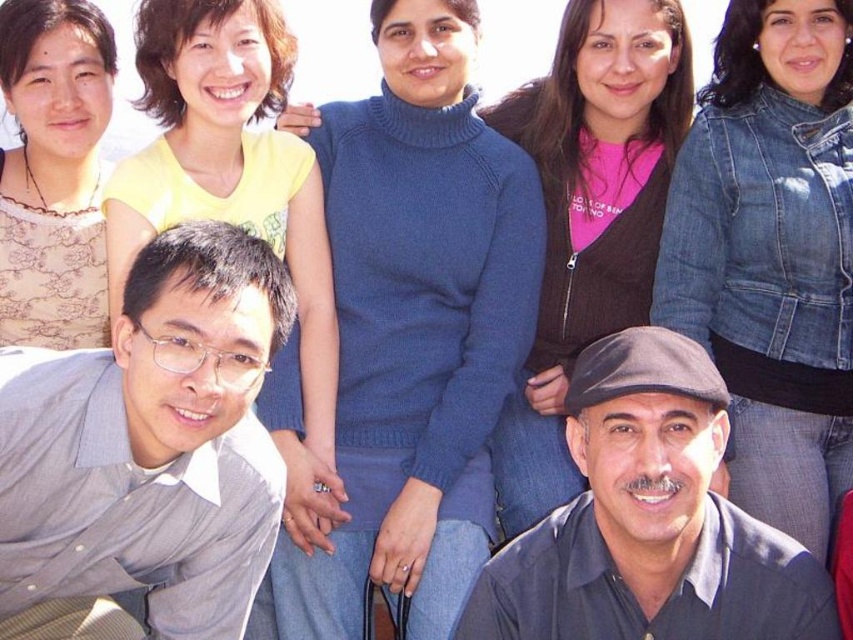
You are a photographer trying to adjust the lighting for a group photo. You notice two elements in the scene that might cast shadows on the subjects. The gray shirt at lower left and the dark gray fabric at lower right. Which of these two items is located more to the left side of the scene?

The gray shirt at lower left is positioned on the left side of dark gray fabric at lower right, so the gray shirt at lower left is located more to the left side of the scene.

You are a photographer trying to decide which gray clothing item to focus on in the image. The gray shirt at lower left and the dark gray fabric at lower right are both in view. Which one is narrower?

The gray shirt at lower left is narrower than the dark gray fabric at lower right.

You are a photographer trying to adjust the lighting for a group photo. You notice the gray shirt at lower left and the dark gray fabric at lower right are casting shadows. Which object should you move to reduce the shadow overlap between them?

The gray shirt at lower left is in front of the dark gray fabric at lower right. To reduce shadow overlap, move the gray shirt at lower left backward so it is no longer blocking the light from reaching the dark gray fabric at lower right.